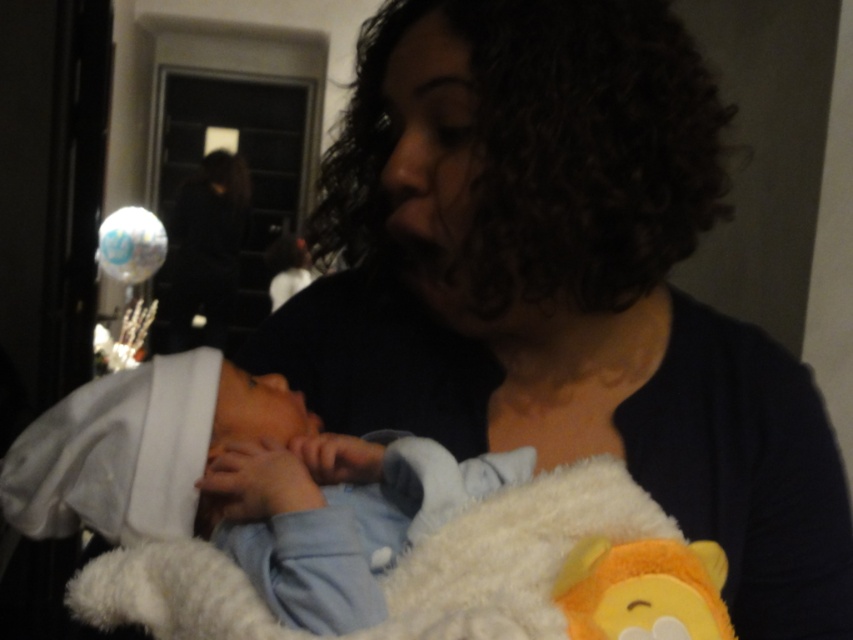
Is white soft blanket at center thinner than fluffy yellow bear at lower center?

No, white soft blanket at center is not thinner than fluffy yellow bear at lower center.

Which of these two, white soft blanket at center or fluffy yellow bear at lower center, stands taller?

white soft blanket at center

Is point (54, 412) more distant than point (637, 593)?

That is True.

The image size is (853, 640). Identify the location of white soft blanket at center. (242, 483).